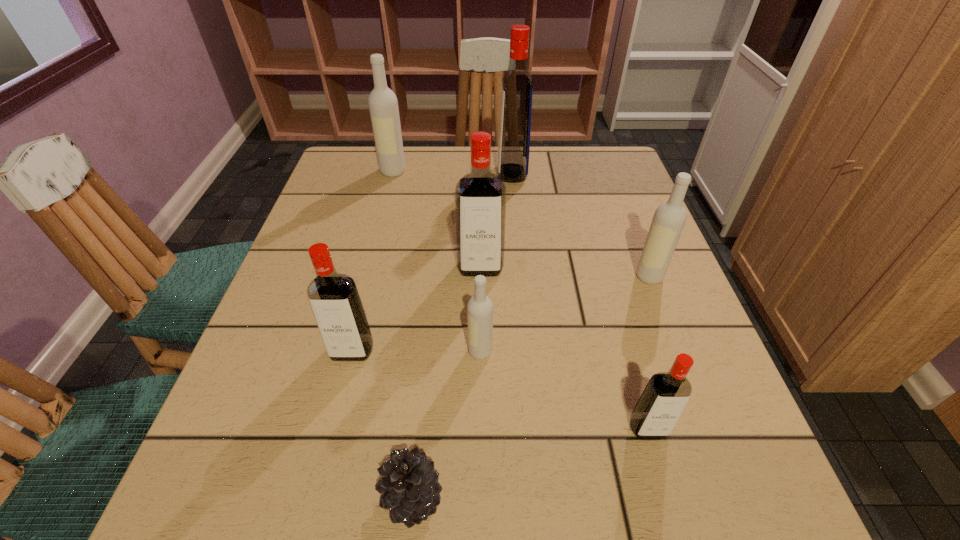
Find the location of a particular element. free space located 0.240m on the front of the rightmost object is located at coordinates (693, 392).

Find the location of `blank area located 0.100m on the front and back of the second smallest red vodka`. blank area located 0.100m on the front and back of the second smallest red vodka is located at coordinates (336, 417).

Locate an element on the screen. This screenshot has width=960, height=540. vacant region located on the front and back of the rightmost red vodka is located at coordinates (674, 519).

What are the coordinates of `vacant area located 0.210m on the front of the smallest white vodka` in the screenshot? It's located at (480, 487).

This screenshot has height=540, width=960. I want to click on free spot located 0.180m on the left of the pinecone, so click(251, 498).

At what (x,y) coordinates should I click in order to perform the action: click on object that is at the near edge. Please return your answer as a coordinate pair (x, y). Looking at the image, I should click on (411, 492).

Locate an element on the screen. The height and width of the screenshot is (540, 960). object at the far left corner is located at coordinates (383, 105).

What are the coordinates of `vacant space at the far edge` in the screenshot? It's located at (453, 170).

Identify the location of free space at the near edge of the desktop. (491, 497).

At what (x,y) coordinates should I click in order to perform the action: click on vacant space at the left edge. Please return your answer as a coordinate pair (x, y). The width and height of the screenshot is (960, 540). Looking at the image, I should click on (238, 455).